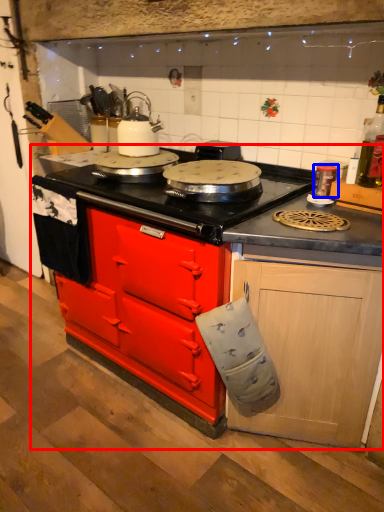
Question: Which of the following is the farthest to the observer, countertop (highlighted by a red box) or kitchen appliance (highlighted by a blue box)?

Choices:
 (A) countertop
 (B) kitchen appliance

Answer: (B)